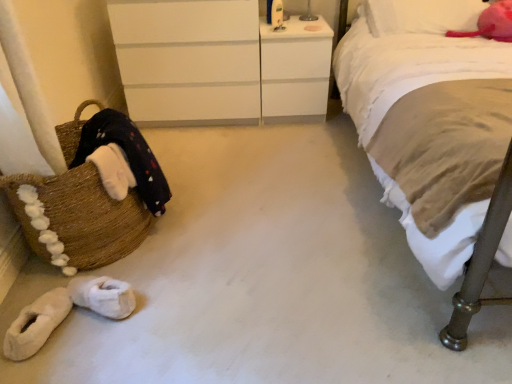
Image resolution: width=512 pixels, height=384 pixels. What are the coordinates of `vacant space to the right of white fluffy slippers at lower left, the first footwear from the left` in the screenshot? It's located at (88, 345).